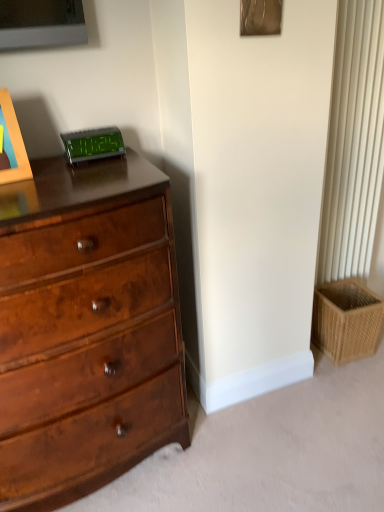
Question: Do you think woven tan basket at lower right is within green digital display at upper center, or outside of it?

Choices:
 (A) outside
 (B) inside

Answer: (A)

Question: From a real-world perspective, is woven tan basket at lower right above or below green digital display at upper center?

Choices:
 (A) above
 (B) below

Answer: (B)

Question: Which is nearer to the woven tan basket at lower right?

Choices:
 (A) shiny brown wood chest of drawers at left
 (B) green digital display at upper center

Answer: (A)

Question: Based on their relative distances, which object is farther from the woven tan basket at lower right?

Choices:
 (A) shiny brown wood chest of drawers at left
 (B) green digital display at upper center

Answer: (B)